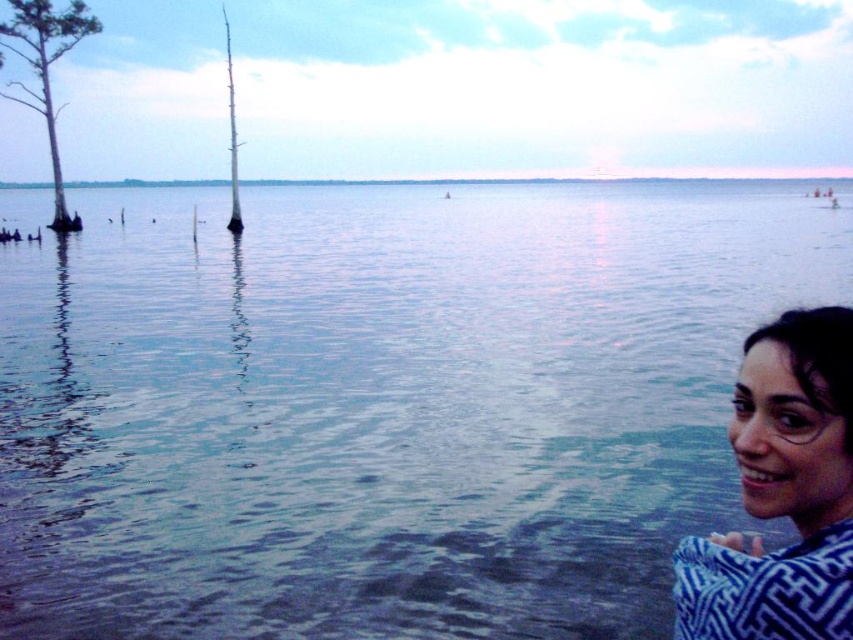
Who is more forward, (653, 477) or (230, 108)?

Point (653, 477)

Can you confirm if clear water at center is positioned above brown wood tree at left?

Incorrect, clear water at center is not positioned above brown wood tree at left.

Is point (633, 310) closer to viewer compared to point (242, 227)?

That is True.

Locate an element on the screen. The image size is (853, 640). clear water at center is located at coordinates (384, 404).

Is clear water at center bigger than green matte tree at left?

No, clear water at center is not bigger than green matte tree at left.

Does point (61, 273) come farther from viewer compared to point (65, 29)?

No, (61, 273) is closer to viewer.

I want to click on clear water at center, so click(x=384, y=404).

This screenshot has width=853, height=640. Identify the location of clear water at center. coord(384,404).

Can you confirm if green matte tree at left is positioned above brown wood tree at left?

No, green matte tree at left is not above brown wood tree at left.

Can you confirm if green matte tree at left is wider than brown wood tree at left?

Yes, green matte tree at left is wider than brown wood tree at left.

Between point (35, 102) and point (228, 51), which one is positioned in front?

Point (35, 102) is in front.

What are the coordinates of `green matte tree at left` in the screenshot? It's located at (45, 70).